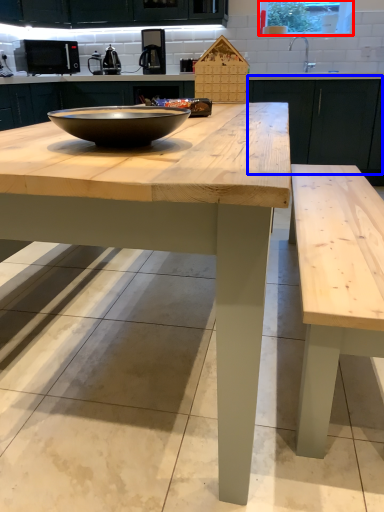
Question: Which point is closer to the camera, window screen (highlighted by a red box) or cabinetry (highlighted by a blue box)?

Choices:
 (A) window screen
 (B) cabinetry

Answer: (B)